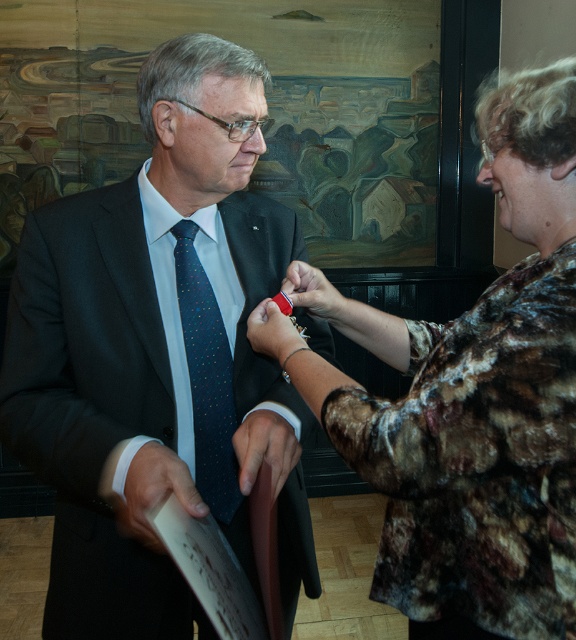
Does floral-patterned fabric at center have a greater height compared to matte red pin at center?

Yes, floral-patterned fabric at center is taller than matte red pin at center.

Between point (412, 589) and point (301, 339), which one is positioned behind?

The point (301, 339) is more distant.

The height and width of the screenshot is (640, 576). In order to click on floral-patterned fabric at center in this screenshot , I will do `click(480, 403)`.

Does matte black suit at center lie in front of matte brown leather at center?

Yes, matte black suit at center is in front of matte brown leather at center.

Does matte black suit at center have a smaller size compared to matte brown leather at center?

Incorrect, matte black suit at center is not smaller in size than matte brown leather at center.

Does point (191, 212) come closer to viewer compared to point (245, 451)?

That is False.

This screenshot has width=576, height=640. I want to click on matte black suit at center, so click(149, 344).

Who is positioned more to the left, dark blue silk tie at center or matte red pin at center?

Positioned to the left is dark blue silk tie at center.

Is point (222, 378) positioned in front of point (272, 305)?

No.

Between point (209, 416) and point (259, 326), which one is positioned in front?

Positioned in front is point (259, 326).

Where is `dark blue silk tie at center`? dark blue silk tie at center is located at coordinates (206, 378).